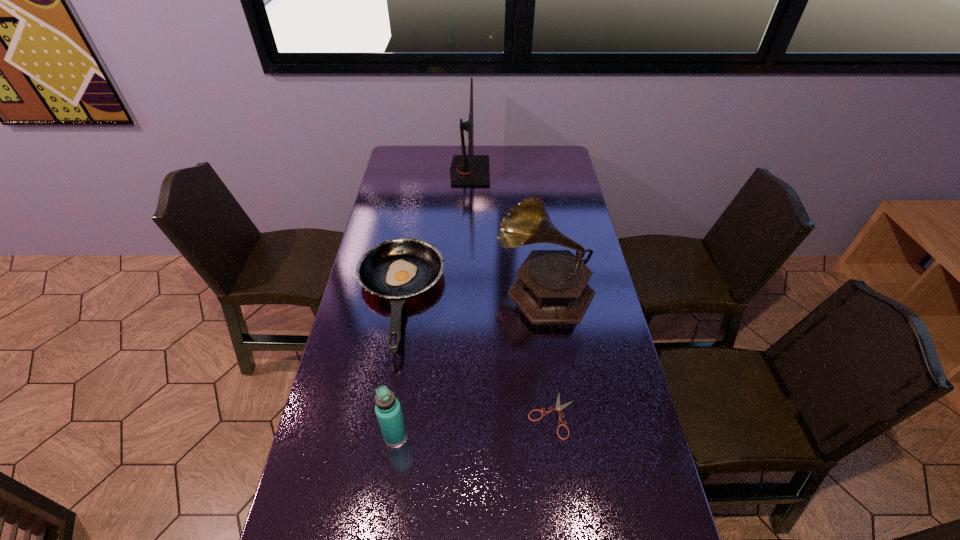
Locate an element on the screen. This screenshot has height=540, width=960. the farthest object is located at coordinates (470, 169).

Locate an element on the screen. This screenshot has width=960, height=540. phonograph record is located at coordinates (551, 286).

I want to click on the third shortest object, so click(x=388, y=410).

Locate an element on the screen. Image resolution: width=960 pixels, height=540 pixels. the second shortest object is located at coordinates (399, 268).

Where is `shears`? The image size is (960, 540). shears is located at coordinates click(x=558, y=408).

This screenshot has height=540, width=960. I want to click on free space located on the screen side of the farthest object, so click(536, 171).

The width and height of the screenshot is (960, 540). Find the location of `vacant space positioned on the horn direction of the phonograph record`. vacant space positioned on the horn direction of the phonograph record is located at coordinates (377, 288).

Find the location of a particular element. vacant region located 0.190m on the horn direction of the phonograph record is located at coordinates (440, 288).

You are a GUI agent. You are given a task and a screenshot of the screen. Output one action in this format:
    pyautogui.click(x=<x>, y=<y>)
    Task: Click on the vacant area situated on the horn direction of the phonograph record
    
    Given the screenshot: What is the action you would take?
    pyautogui.click(x=401, y=288)

Find the location of a particular element. vacant point located 0.100m on the front of the third tallest object is located at coordinates (388, 488).